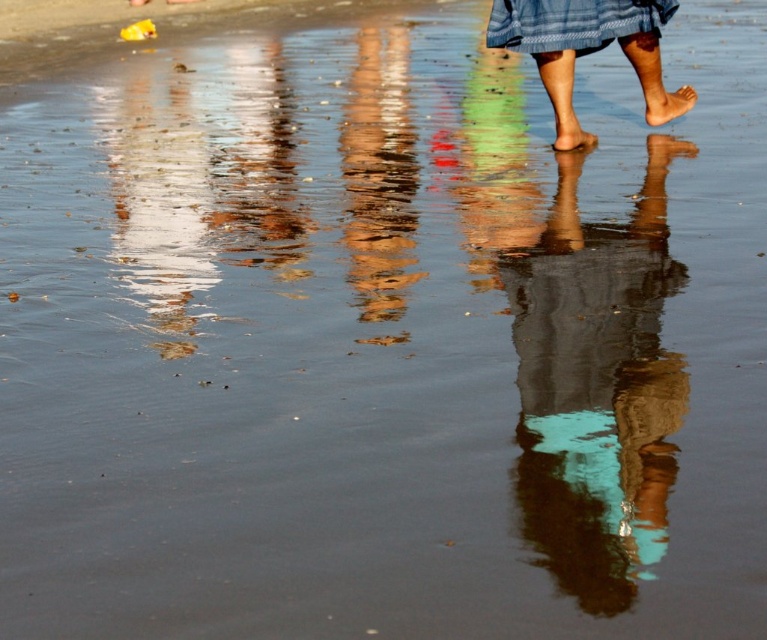
You are standing at the location of the viewer in the beach scene. There is a shiny metallic pole at center. If you want to reach the pole, how many steps would you need to take if each step covers 0.7 meters?

The distance between the viewer and the shiny metallic pole at center is 4.18 meters. Each step covers 0.7 meters. Dividing 4.18 by 0.7 gives approximately 5.97 steps. Since you can take partial steps, you would need around 6 steps to reach the pole.

You are a photographer trying to capture the reflection of the teal fabric at center and the smooth skin foot at center in the water. Which one will have a larger reflection area in the water?

The teal fabric at center is taller than the smooth skin foot at center, so its reflection in the water will be larger.